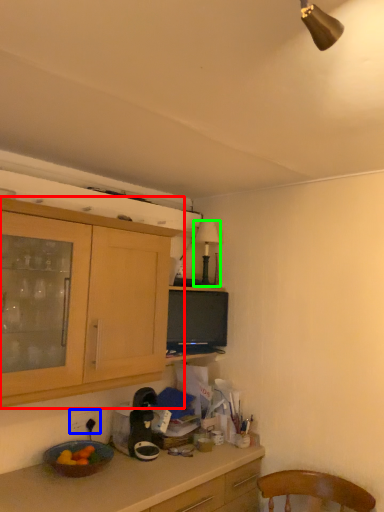
Question: Which object is the closest to the cabinetry (highlighted by a red box)? Choose among these: power outlet (highlighted by a blue box) or lamp (highlighted by a green box).

Choices:
 (A) power outlet
 (B) lamp

Answer: (A)